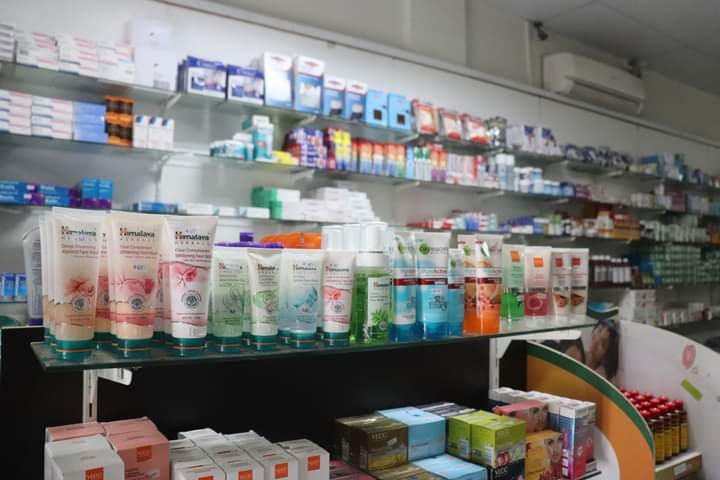
Where is `shelf holder`? The image size is (720, 480). shelf holder is located at coordinates (93, 407).